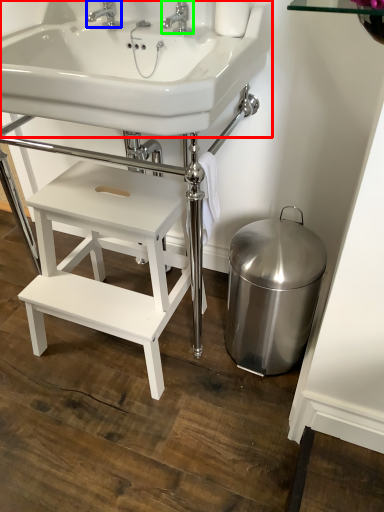
Question: Which object is positioned farthest from sink (highlighted by a red box)? Select from tap (highlighted by a blue box) and tap (highlighted by a green box).

Choices:
 (A) tap
 (B) tap

Answer: (A)